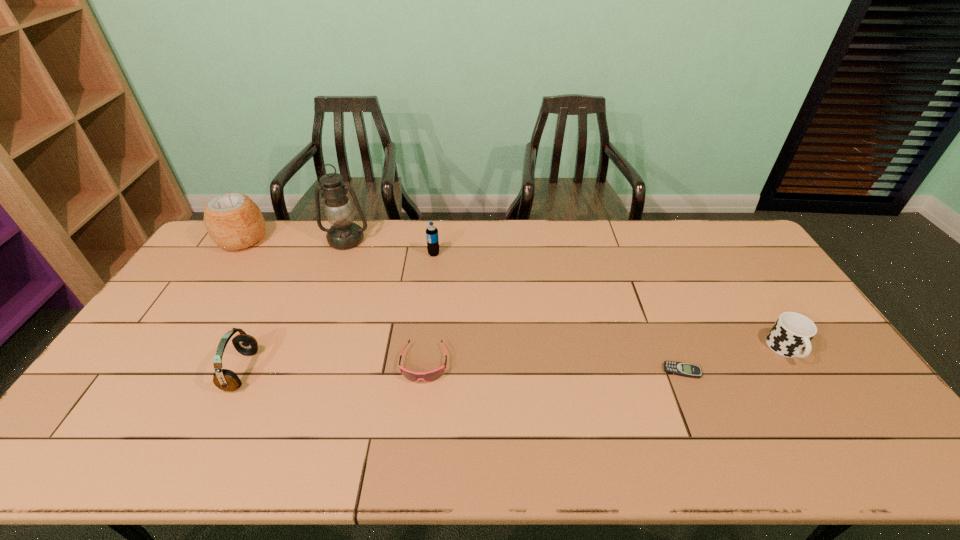
Locate an element on the screen. This screenshot has height=540, width=960. the sixth object from left to right is located at coordinates (677, 368).

Where is `vacant region located on the left of the tallest object`? The image size is (960, 540). vacant region located on the left of the tallest object is located at coordinates (222, 240).

This screenshot has height=540, width=960. I want to click on free space located 0.310m on the right of the leftmost object, so click(x=352, y=240).

Locate an element on the screen. The width and height of the screenshot is (960, 540). vacant space situated 0.210m on the left of the soda bottle is located at coordinates (369, 254).

You are a GUI agent. You are given a task and a screenshot of the screen. Output one action in this format:
    pyautogui.click(x=<x>, y=<y>)
    Task: Click on the free region located 0.220m on the ear cups of the headset
    The image size is (960, 540).
    Given the screenshot: What is the action you would take?
    pyautogui.click(x=335, y=370)

Locate an element on the screen. The height and width of the screenshot is (540, 960). free spot located 0.230m on the side of the rightmost object with the handle is located at coordinates (851, 449).

Locate an element on the screen. blank space located 0.200m on the front-facing side of the goggles is located at coordinates (413, 459).

The width and height of the screenshot is (960, 540). I want to click on vacant space located 0.250m on the right of the shortest object, so click(793, 371).

Find the location of a particular element. This screenshot has height=540, width=960. oil lamp located at the far edge is located at coordinates (343, 234).

This screenshot has height=540, width=960. I want to click on coconut that is at the far edge, so click(233, 221).